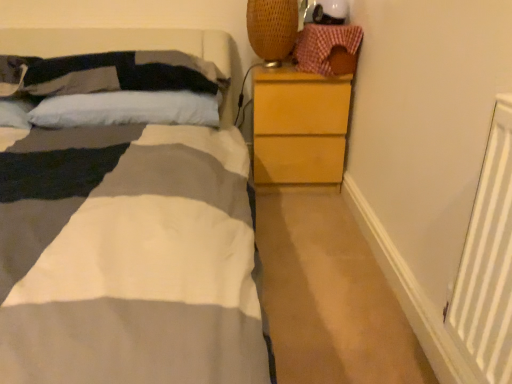
Question: From the image's perspective, would you say checkered fabric basket at upper right is positioned over white soft pillow at upper left, acting as the 2th pillow starting from the top?

Choices:
 (A) yes
 (B) no

Answer: (A)

Question: Does checkered fabric basket at upper right have a smaller size compared to white soft pillow at upper left, the first pillow positioned from the bottom?

Choices:
 (A) no
 (B) yes

Answer: (B)

Question: Is checkered fabric basket at upper right far from white soft pillow at upper left, acting as the 2th pillow starting from the top?

Choices:
 (A) no
 (B) yes

Answer: (A)

Question: From a real-world perspective, is checkered fabric basket at upper right under white soft pillow at upper left, acting as the 2th pillow starting from the top?

Choices:
 (A) yes
 (B) no

Answer: (B)

Question: Is checkered fabric basket at upper right oriented away from white soft pillow at upper left, acting as the 2th pillow starting from the top?

Choices:
 (A) no
 (B) yes

Answer: (A)

Question: Is point (309, 155) closer or farther from the camera than point (329, 34)?

Choices:
 (A) farther
 (B) closer

Answer: (A)

Question: Is light brown wooden chest of drawers at right inside the boundaries of checkered fabric basket at upper right, or outside?

Choices:
 (A) outside
 (B) inside

Answer: (A)

Question: Looking at the image, does light brown wooden chest of drawers at right seem bigger or smaller compared to checkered fabric basket at upper right?

Choices:
 (A) big
 (B) small

Answer: (A)

Question: Is light brown wooden chest of drawers at right taller or shorter than checkered fabric basket at upper right?

Choices:
 (A) tall
 (B) short

Answer: (A)

Question: Is checkered fabric basket at upper right wider or thinner than light brown wooden chest of drawers at right?

Choices:
 (A) thin
 (B) wide

Answer: (A)

Question: In terms of size, does checkered fabric basket at upper right appear bigger or smaller than light brown wooden chest of drawers at right?

Choices:
 (A) big
 (B) small

Answer: (B)

Question: Choose the correct answer: Is checkered fabric basket at upper right inside light brown wooden chest of drawers at right or outside it?

Choices:
 (A) inside
 (B) outside

Answer: (B)

Question: From the image's perspective, is checkered fabric basket at upper right above or below light brown wooden chest of drawers at right?

Choices:
 (A) below
 (B) above

Answer: (B)

Question: In the image, is soft cotton pillow at upper left, the 1th pillow positioned from the top, positioned in front of or behind white soft pillow at upper left, acting as the 2th pillow starting from the top?

Choices:
 (A) behind
 (B) front

Answer: (B)

Question: Does point (200, 92) appear closer or farther from the camera than point (179, 96)?

Choices:
 (A) farther
 (B) closer

Answer: (A)